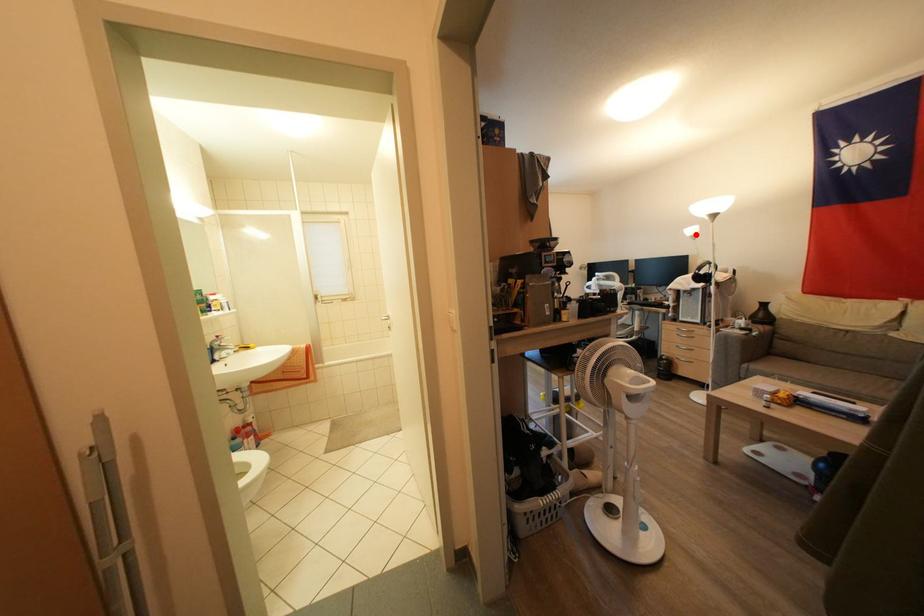
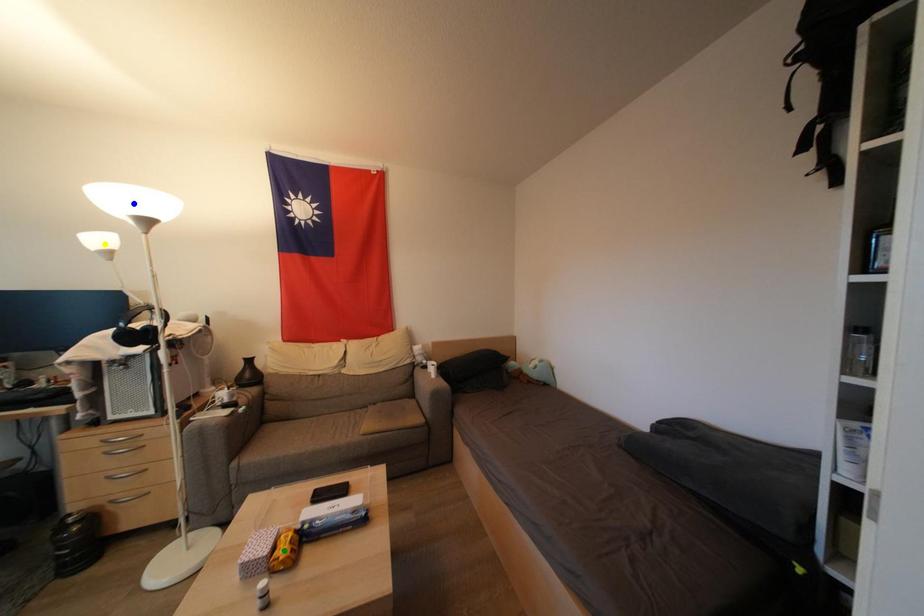
Question: I am providing you with two images of the same scene from different viewpoints. A red point is marked on the first image. You are given multiple points on the second image. Which point in image 2 is actually the same real-world point as the red point in image 1?

Choices:
 (A) green point
 (B) yellow point
 (C) blue point

Answer: (B)